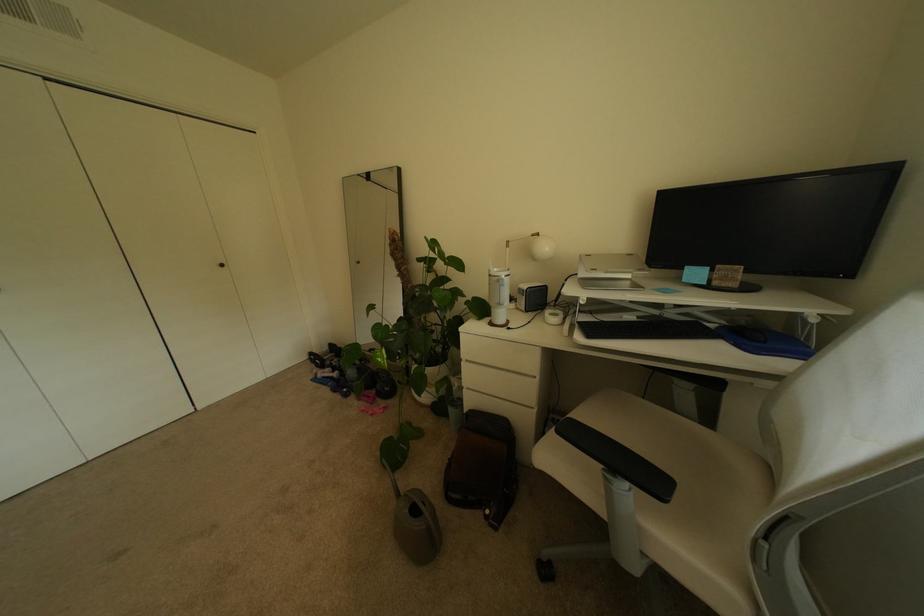
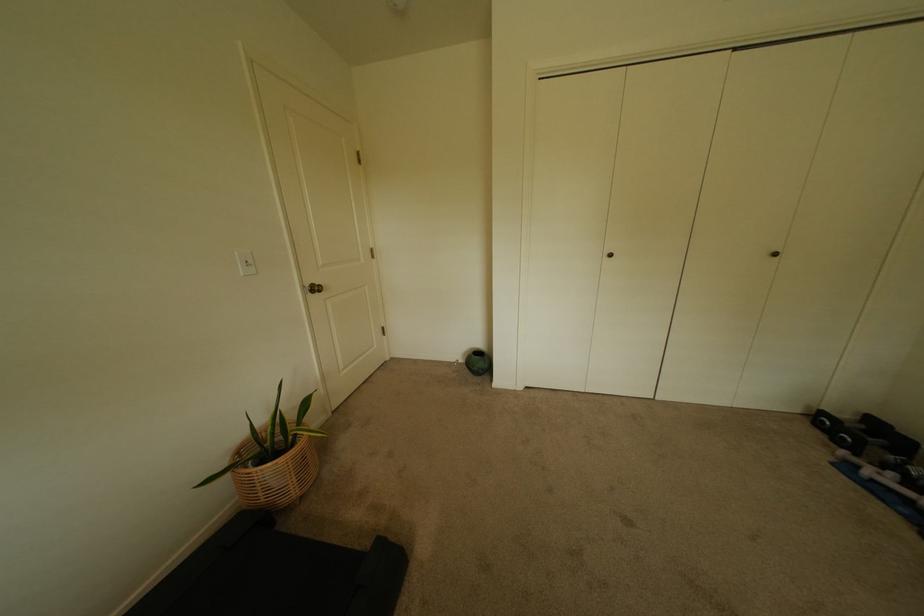
In the second image, find the point that corresponds to [320,355] in the first image.

(831, 415)